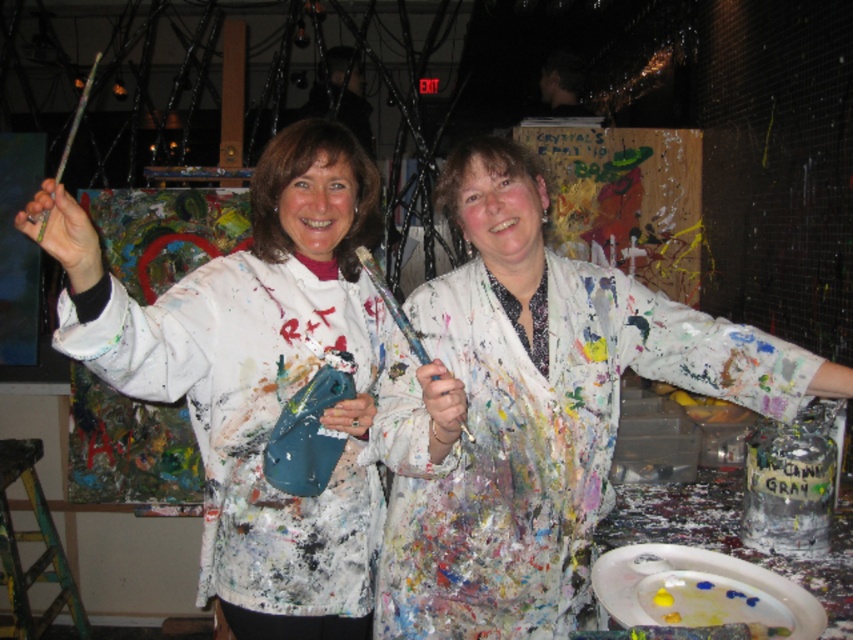
Can you confirm if paint-splattered white shirt at center is positioned above worn wooden paintbrush at center?

Incorrect, paint-splattered white shirt at center is not positioned above worn wooden paintbrush at center.

Between point (740, 326) and point (367, 275), which one is positioned behind?

Point (740, 326)

This screenshot has height=640, width=853. What are the coordinates of `paint-splattered white shirt at center` in the screenshot? It's located at (531, 408).

Does white paint-splattered shirt at center lie in front of worn wooden paintbrush at center?

Yes, white paint-splattered shirt at center is closer to the viewer.

Image resolution: width=853 pixels, height=640 pixels. What do you see at coordinates (254, 376) in the screenshot?
I see `white paint-splattered shirt at center` at bounding box center [254, 376].

Locate an element on the screen. The image size is (853, 640). white paint-splattered shirt at center is located at coordinates (254, 376).

Image resolution: width=853 pixels, height=640 pixels. What are the coordinates of `white paint-splattered shirt at center` in the screenshot? It's located at (254, 376).

Between white paint-splattered shirt at center and green metallic paint brush at upper left, which one is positioned higher?

green metallic paint brush at upper left is higher up.

Can you confirm if white paint-splattered shirt at center is shorter than green metallic paint brush at upper left?

No.

Describe the element at coordinates (254, 376) in the screenshot. I see `white paint-splattered shirt at center` at that location.

The width and height of the screenshot is (853, 640). In order to click on white paint-splattered shirt at center in this screenshot , I will do `click(254, 376)`.